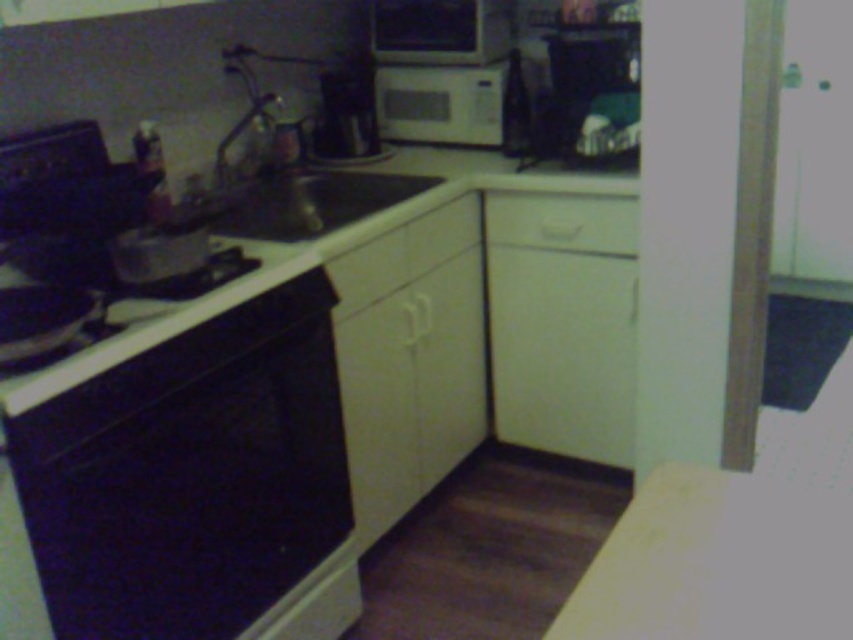
Question: Which of the following is the farthest from the observer?

Choices:
 (A) (689, 564)
 (B) (438, 100)
 (C) (244, 554)

Answer: (B)

Question: Is black glossy oven at lower left closer to camera compared to white matte drawer at center?

Choices:
 (A) yes
 (B) no

Answer: (A)

Question: From the image, what is the correct spatial relationship of black glossy oven at lower left in relation to white matte microwave at upper center?

Choices:
 (A) left
 (B) right

Answer: (A)

Question: Does black glossy stove at lower left have a larger size compared to white matte drawer at center?

Choices:
 (A) yes
 (B) no

Answer: (A)

Question: Which is nearer to the white matte drawer at center?

Choices:
 (A) white matte counter top at lower right
 (B) black glossy stove at lower left
 (C) black glossy oven at lower left
 (D) white matte microwave at upper center

Answer: (D)

Question: Which point is farther to the camera?

Choices:
 (A) black glossy oven at lower left
 (B) white matte drawer at center
 (C) white matte microwave at upper center

Answer: (C)